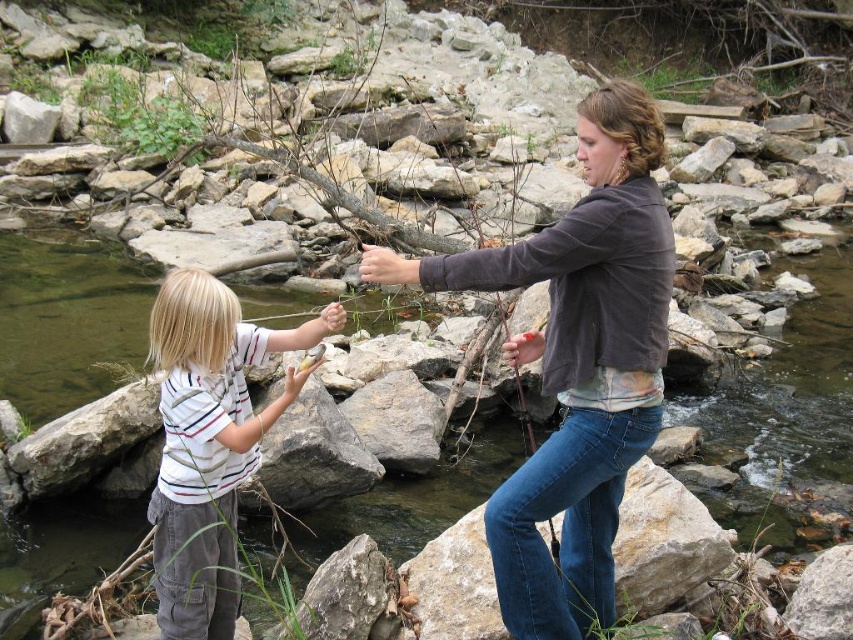
You are a photographer trying to capture a candid shot of the two people in the scene. You want to ensure both the matte brown jacket at center and the white striped shirt at center are clearly visible in your photo. Based on their positions, which clothing item is closer to the camera?

The matte brown jacket at center is in front of the white striped shirt at center, so the matte brown jacket at center is closer to the camera.

In the scene shown: You are standing in the middle of the rocky stream and want to place a small flag at each of the two points marked as point (602, 161) and point (161, 397). Which point will require you to walk further away from your current position to place the flag?

Point (161, 397) is further from the viewer than point (602, 161), so you will need to walk further away to place the flag at point (161, 397).